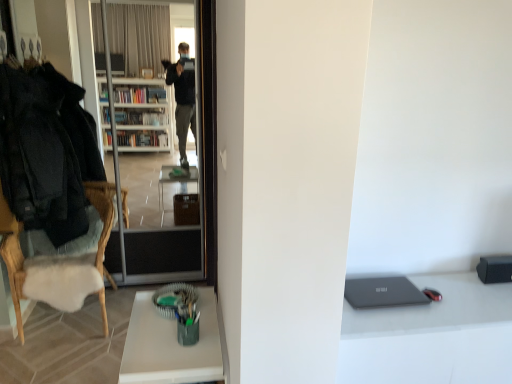
What are the coordinates of `free spot above matte gray laptop at lower right (from a real-world perspective)` in the screenshot? It's located at (380, 293).